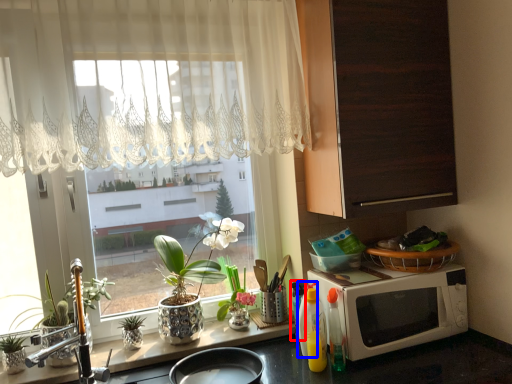
Question: Among these objects, which one is nearest to the camera, bottle (highlighted by a red box) or bottle (highlighted by a blue box)?

Choices:
 (A) bottle
 (B) bottle

Answer: (B)